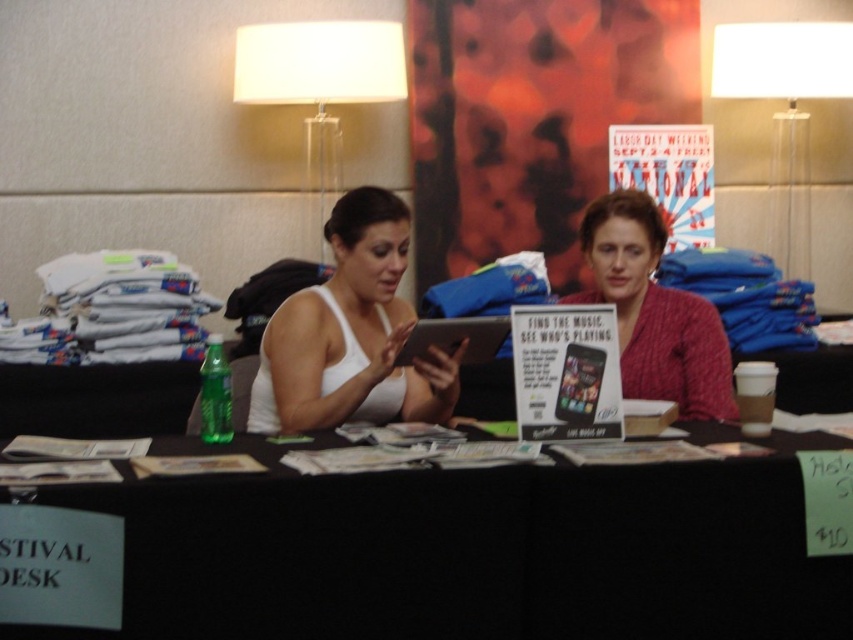
Does matte black tablet at center have a smaller size compared to black glossy tablet at center?

Actually, matte black tablet at center might be larger than black glossy tablet at center.

Can you confirm if matte black tablet at center is positioned above black glossy tablet at center?

Yes.

Where is `matte black tablet at center`? matte black tablet at center is located at coordinates (456, 339).

In the scene shown: Who is taller, white matte tank top at center or black glossy tablet at center?

white matte tank top at center

Does white matte tank top at center come behind black glossy tablet at center?

Yes, it is.

Where is `white matte tank top at center`? white matte tank top at center is located at coordinates (351, 333).

Is point (392, 333) farther from viewer compared to point (436, 340)?

That is False.

Between white matte tank top at center and matte black tablet at center, which one appears on the left side from the viewer's perspective?

From the viewer's perspective, white matte tank top at center appears more on the left side.

Locate an element on the screen. white matte tank top at center is located at coordinates (351, 333).